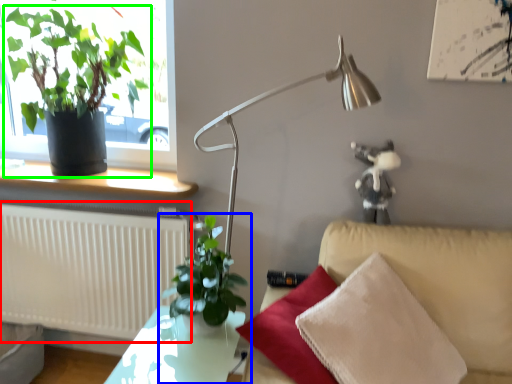
Question: Which object is the closest to the radiator (highlighted by a red box)? Choose among these: houseplant (highlighted by a blue box) or houseplant (highlighted by a green box).

Choices:
 (A) houseplant
 (B) houseplant

Answer: (B)